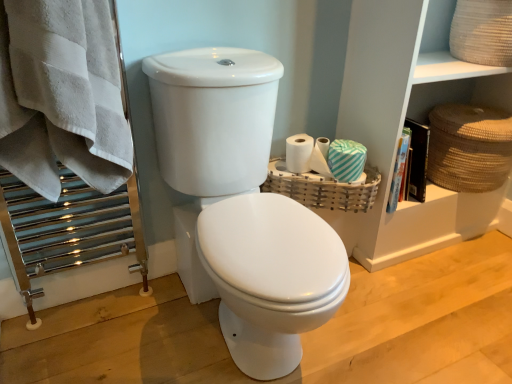
Image resolution: width=512 pixels, height=384 pixels. I want to click on free space in front of rattan basket at upper right, which ranks as the first shelf in bottom-to-top order, so tap(435, 295).